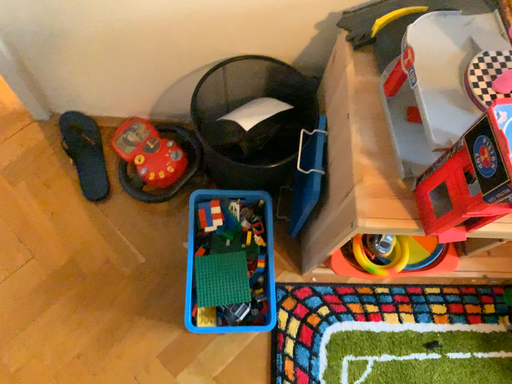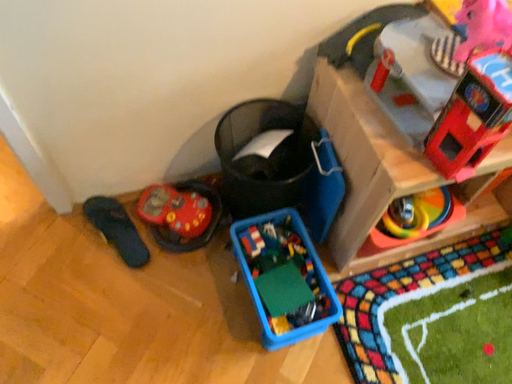
Question: Which way did the camera rotate in the video?

Choices:
 (A) rotated upward
 (B) rotated downward

Answer: (A)